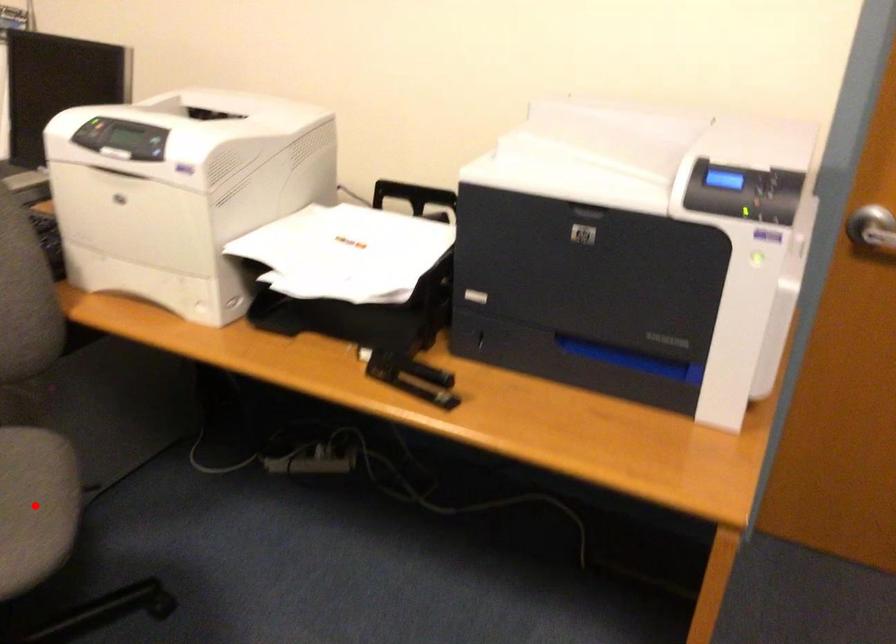
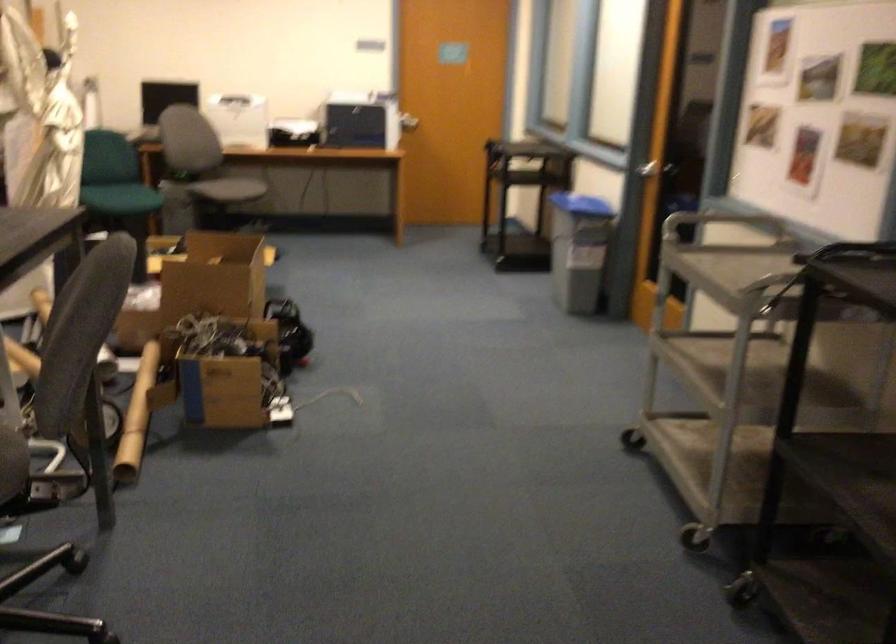
Question: I am providing you with two images of the same scene from different viewpoints. A red point is marked on the first image. Can you still see the location of the red point in image 2?

Choices:
 (A) Yes
 (B) No

Answer: (B)